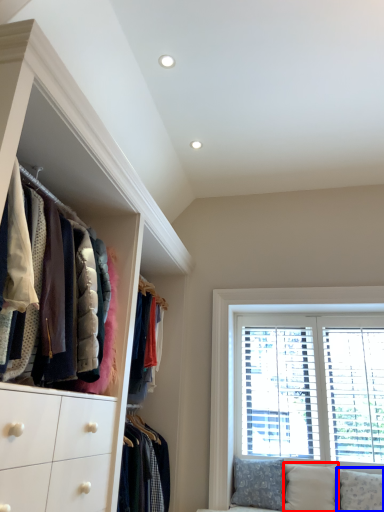
Question: Which point is further to the camera, pillow (highlighted by a red box) or pillow (highlighted by a blue box)?

Choices:
 (A) pillow
 (B) pillow

Answer: (A)